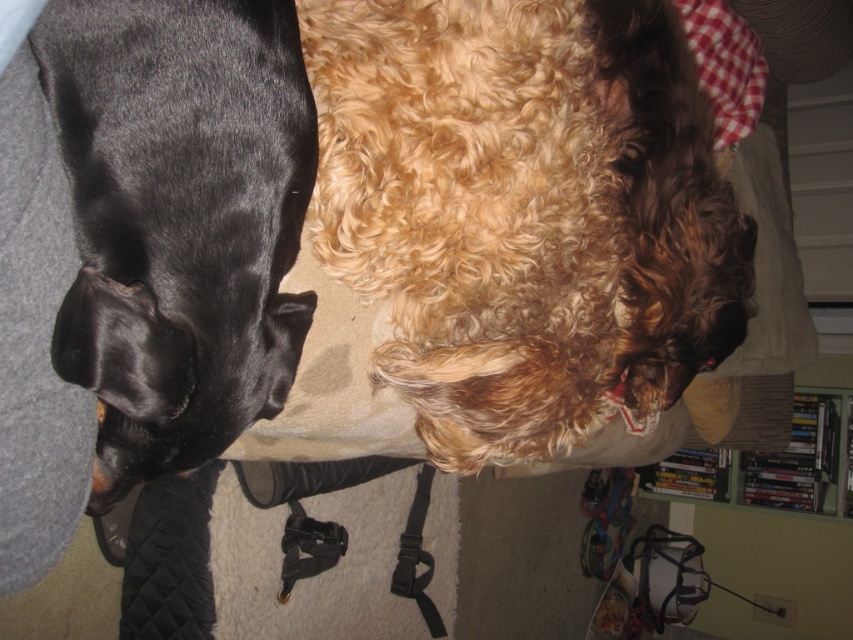
Question: Which point appears closest to the camera in this image?

Choices:
 (A) (439, 284)
 (B) (265, 132)

Answer: (B)

Question: Where is curly golden fur at upper center located in relation to shiny black dog at left in the image?

Choices:
 (A) right
 (B) left

Answer: (A)

Question: Does curly golden fur at upper center have a lesser width compared to shiny black dog at left?

Choices:
 (A) no
 (B) yes

Answer: (A)

Question: Which object appears farthest from the camera in this image?

Choices:
 (A) shiny black dog at left
 (B) curly golden fur at upper center

Answer: (B)

Question: Is curly golden fur at upper center behind shiny black dog at left?

Choices:
 (A) yes
 (B) no

Answer: (A)